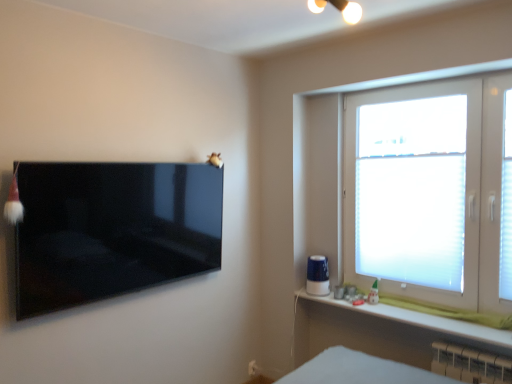
Question: Considering the relative positions of white translucent blinds at right and white plastic radiator at lower right in the image provided, is white translucent blinds at right to the right of white plastic radiator at lower right from the viewer's perspective?

Choices:
 (A) yes
 (B) no

Answer: (B)

Question: From a real-world perspective, is white translucent blinds at right positioned over white plastic radiator at lower right based on gravity?

Choices:
 (A) no
 (B) yes

Answer: (B)

Question: Is white translucent blinds at right positioned before white plastic radiator at lower right?

Choices:
 (A) no
 (B) yes

Answer: (A)

Question: Is white translucent blinds at right shorter than white plastic radiator at lower right?

Choices:
 (A) no
 (B) yes

Answer: (A)

Question: Is white translucent blinds at right surrounding white plastic radiator at lower right?

Choices:
 (A) no
 (B) yes

Answer: (A)

Question: Does white translucent blinds at right come behind white plastic radiator at lower right?

Choices:
 (A) yes
 (B) no

Answer: (A)

Question: From a real-world perspective, is white frosted glass window at right beneath white translucent blinds at right?

Choices:
 (A) no
 (B) yes

Answer: (A)

Question: Is the depth of white frosted glass window at right less than that of white translucent blinds at right?

Choices:
 (A) no
 (B) yes

Answer: (B)

Question: Considering the relative positions of white frosted glass window at right and white translucent blinds at right in the image provided, is white frosted glass window at right behind white translucent blinds at right?

Choices:
 (A) yes
 (B) no

Answer: (B)

Question: Is white frosted glass window at right facing away from white translucent blinds at right?

Choices:
 (A) no
 (B) yes

Answer: (B)

Question: Does white frosted glass window at right turn towards white translucent blinds at right?

Choices:
 (A) yes
 (B) no

Answer: (A)

Question: Considering the relative sizes of white frosted glass window at right and white translucent blinds at right in the image provided, is white frosted glass window at right shorter than white translucent blinds at right?

Choices:
 (A) yes
 (B) no

Answer: (B)

Question: Is white translucent blinds at right directly adjacent to glossy black tv at left?

Choices:
 (A) yes
 (B) no

Answer: (B)